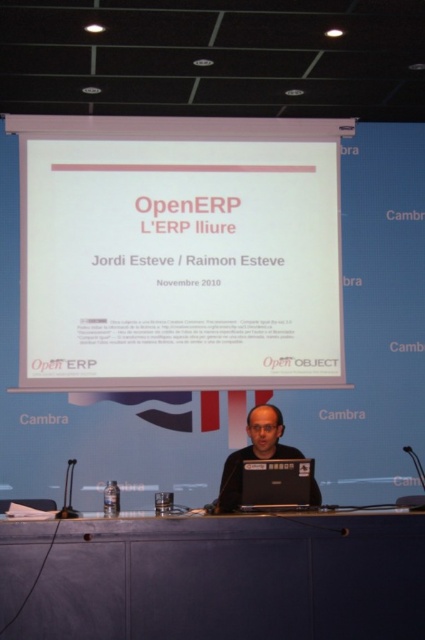
Is white paper at center to the left of matte black laptop at center from the viewer's perspective?

Indeed, white paper at center is positioned on the left side of matte black laptop at center.

Who is higher up, white paper at center or matte black laptop at center?

white paper at center is above.

Is point (323, 129) positioned behind point (227, 465)?

Yes, it is.

The width and height of the screenshot is (425, 640). Find the location of `white paper at center`. white paper at center is located at coordinates (180, 256).

Between white paper at center and black glossy laptop at center, which one has less height?

black glossy laptop at center is shorter.

I want to click on white paper at center, so click(180, 256).

Does dark gray matte table at center have a smaller size compared to black glossy laptop at center?

Incorrect, dark gray matte table at center is not smaller in size than black glossy laptop at center.

Can you confirm if dark gray matte table at center is positioned below black glossy laptop at center?

Indeed, dark gray matte table at center is positioned under black glossy laptop at center.

Who is more distant from viewer, (x=65, y=566) or (x=272, y=483)?

The point (x=272, y=483) is behind.

The height and width of the screenshot is (640, 425). I want to click on dark gray matte table at center, so click(215, 577).